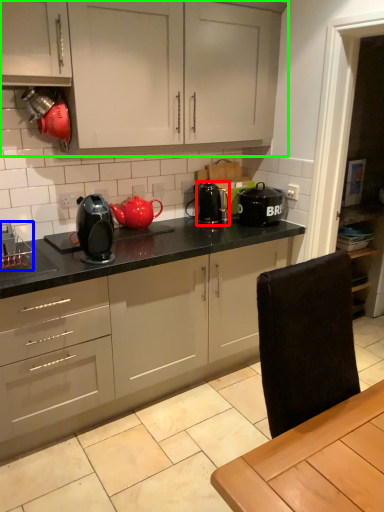
Question: Which is nearer to the appliance (highlighted by a red box)? appliance (highlighted by a blue box) or cabinetry (highlighted by a green box).

Choices:
 (A) appliance
 (B) cabinetry

Answer: (B)